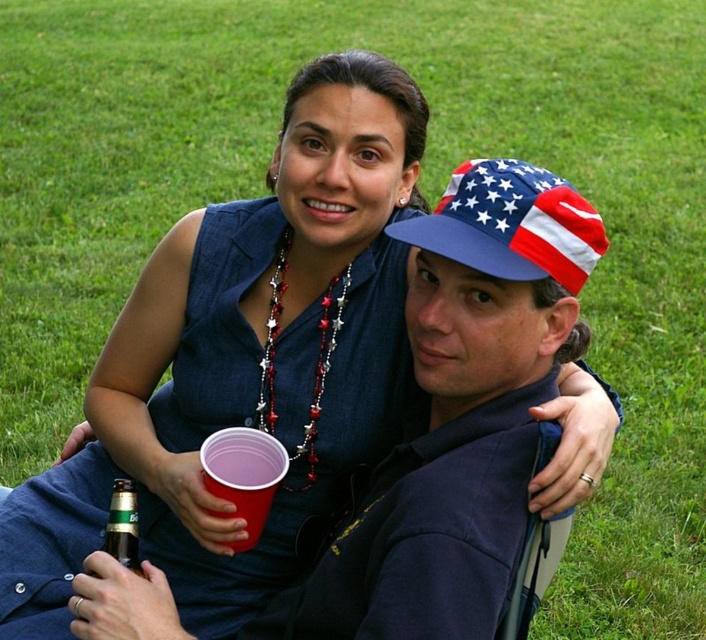
You are a photographer trying to capture the american flag fabric cap at upper right in your shot. The camera is positioned at the center of the image. Can you estimate whether the cap is located to the left or right of the center?

The american flag fabric cap at upper right is located at point 0.352 on the x coordinate, which is to the left of the center point at 0.5. Therefore, the cap is positioned to the left of the center.

You are standing at the origin point of the coordinate system. You see two points in the image, point (566, 192) and point (128, 486). Which point is closer to you?

Point (566, 192) is in front of point (128, 486), so it is closer to you.

You are a photographer standing in front of the scene. You want to take a photo of the green matte bottle at lower left without the american flag fabric cap at upper right blocking it. Is it possible to adjust your position to achieve this?

The american flag fabric cap at upper right is in front of green matte bottle at lower left, so moving your position might allow you to angle the camera so the cap is no longer blocking the bottle.